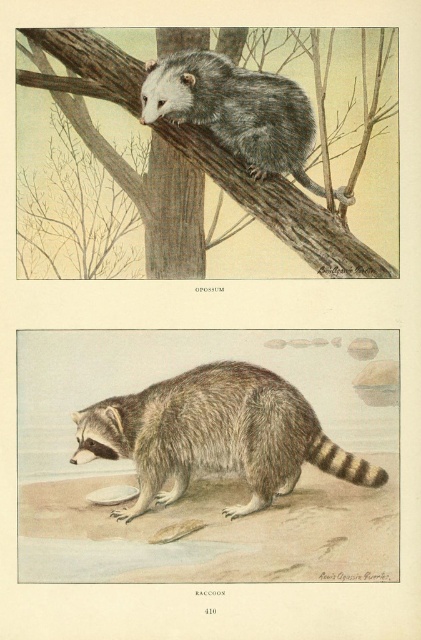
Does point (260, 378) come behind point (304, 147)?

No, (260, 378) is in front of (304, 147).

In the scene shown: Does brown fur raccoon at lower center have a greater width compared to gray furry opossum at upper center?

Yes.

Who is more distant from viewer, (175, 452) or (271, 93)?

Positioned behind is point (271, 93).

The height and width of the screenshot is (640, 421). I want to click on brown fur raccoon at lower center, so click(215, 435).

Is point (71, 40) positioned after point (298, 113)?

No, it is not.

Who is higher up, smooth brown tree trunk at upper center or gray furry opossum at upper center?

gray furry opossum at upper center is above.

Image resolution: width=421 pixels, height=640 pixels. What do you see at coordinates (282, 209) in the screenshot? I see `smooth brown tree trunk at upper center` at bounding box center [282, 209].

Locate an element on the screen. This screenshot has height=640, width=421. smooth brown tree trunk at upper center is located at coordinates (282, 209).

Which of these two, brown fur raccoon at lower center or smooth brown tree trunk at upper center, stands shorter?

With less height is brown fur raccoon at lower center.

Consider the image. Who is more forward, [141,394] or [125,54]?

Point [141,394] is more forward.

Who is more distant from viewer, (x=133, y=436) or (x=63, y=42)?

The point (x=63, y=42) is more distant.

Image resolution: width=421 pixels, height=640 pixels. Identify the location of brown fur raccoon at lower center. (215, 435).